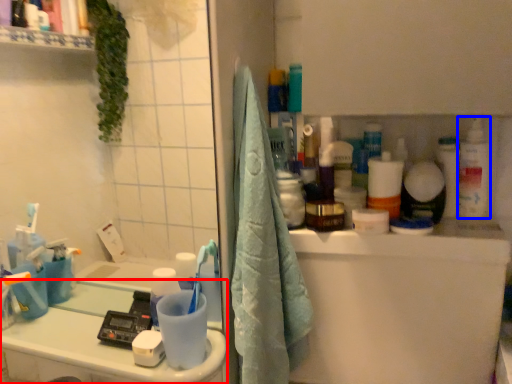
Question: Which object is further to the camera taking this photo, counter top (highlighted by a red box) or cleaning product (highlighted by a blue box)?

Choices:
 (A) counter top
 (B) cleaning product

Answer: (B)